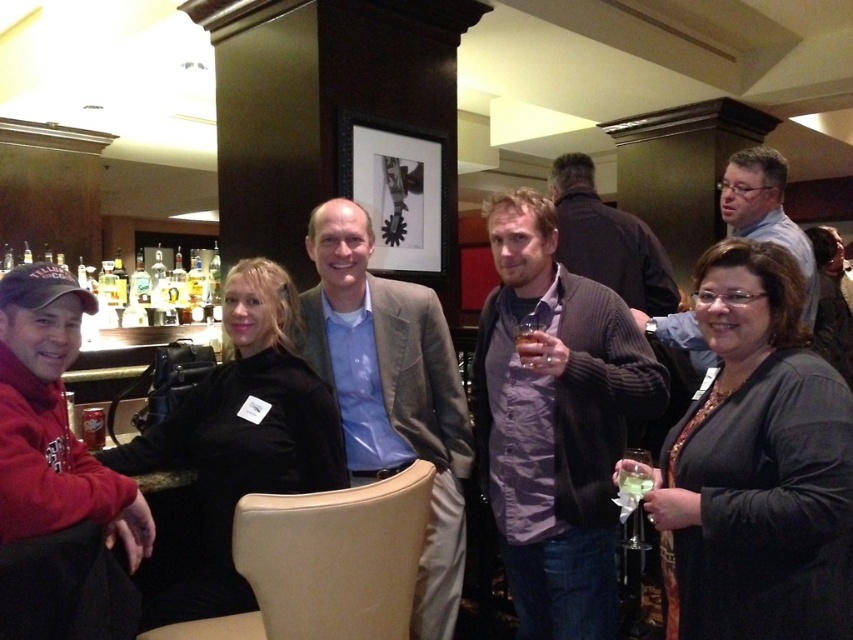
Question: Can you confirm if light brown textured blazer at center is smaller than clear glass wine glass at lower center?

Choices:
 (A) no
 (B) yes

Answer: (A)

Question: Which point is closer to the camera taking this photo?

Choices:
 (A) (630, 488)
 (B) (602, 284)

Answer: (A)

Question: Among these objects, which one is farthest from the camera?

Choices:
 (A) clear glass at center
 (B) matte gray shirt at center
 (C) clear glass wine glass at lower center

Answer: (B)

Question: In this image, where is knit sweater at center located relative to clear glass wine glass at lower center?

Choices:
 (A) above
 (B) below

Answer: (A)

Question: Does dark brown jacket at center have a larger size compared to clear glass wine glass at lower center?

Choices:
 (A) no
 (B) yes

Answer: (B)

Question: Which point is closer to the camera?

Choices:
 (A) dark brown jacket at center
 (B) clear glass wine glass at lower center
 (C) matte gray shirt at center
 (D) knit sweater at center

Answer: (B)